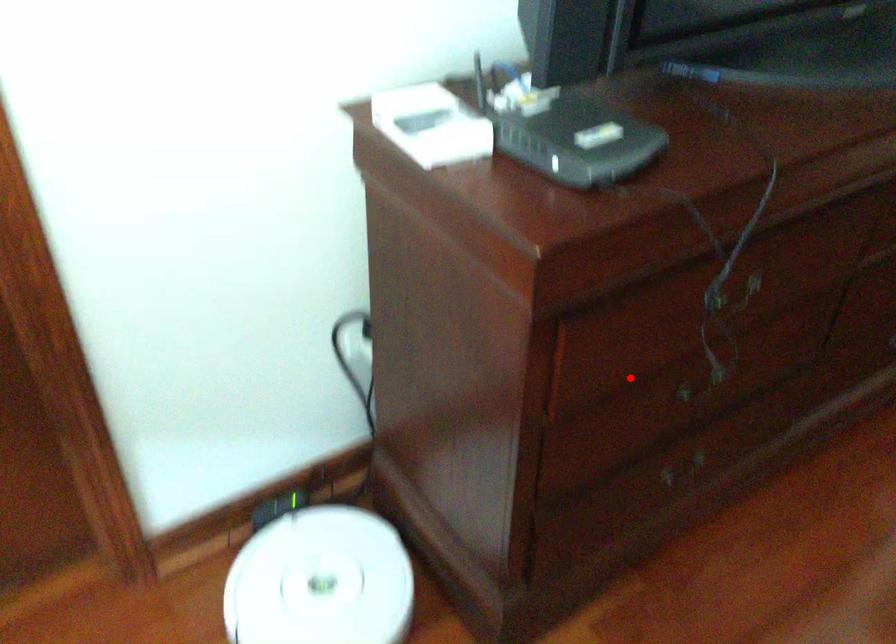
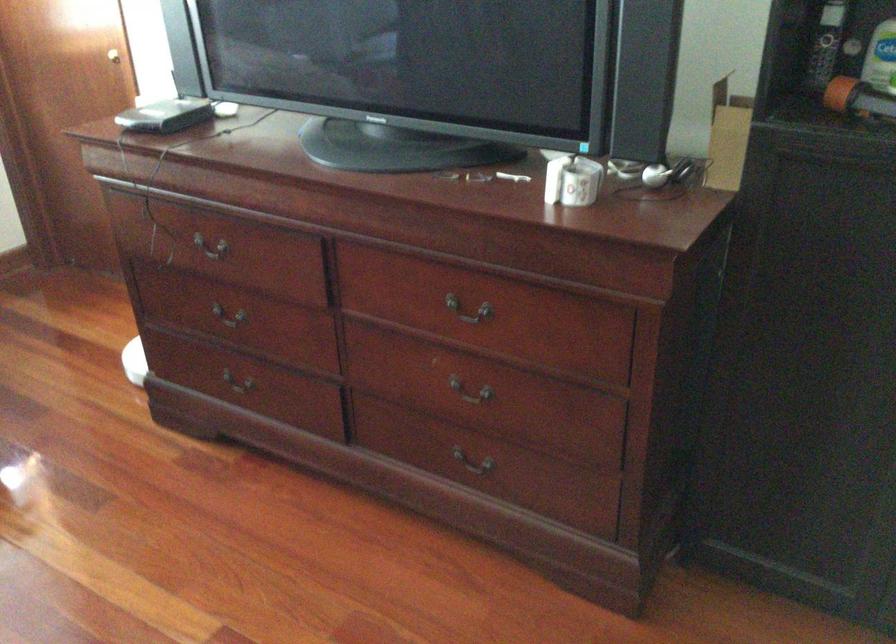
Question: I am providing you with two images of the same scene from different viewpoints. Image1 has a red point marked. In image2, the corresponding 3D location appears at what relative position? Reply with the corresponding letter.

Choices:
 (A) Closer
 (B) Farther

Answer: (B)